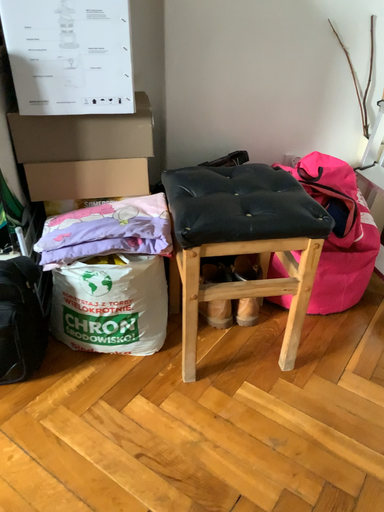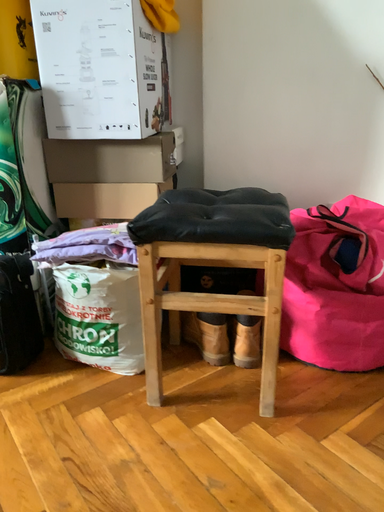
Question: Which way did the camera rotate in the video?

Choices:
 (A) rotated downward
 (B) rotated upward

Answer: (B)